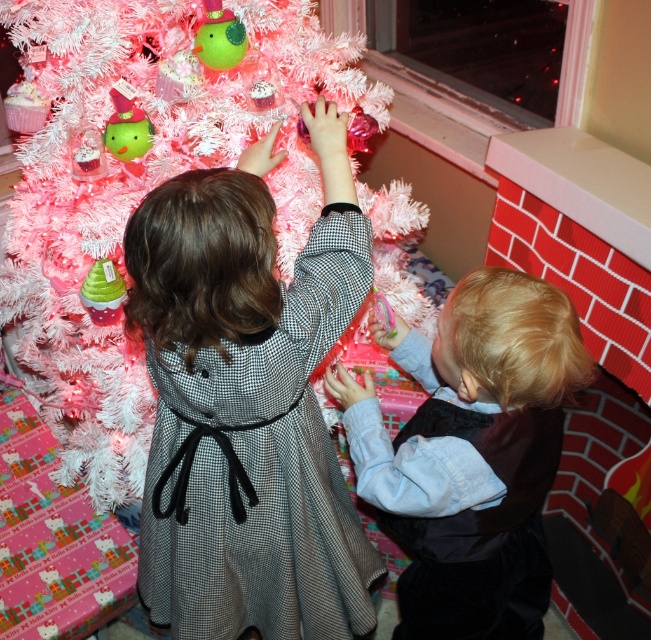
Question: Considering the real-world distances, which object is farthest from the blonde hair at lower right?

Choices:
 (A) white tinsel christmas tree at upper left
 (B) matte gray dress at center

Answer: (A)

Question: Is white tinsel christmas tree at upper left below blonde hair at lower right?

Choices:
 (A) yes
 (B) no

Answer: (B)

Question: Does matte gray dress at center have a smaller size compared to blonde hair at lower right?

Choices:
 (A) yes
 (B) no

Answer: (B)

Question: Which point is closer to the camera?

Choices:
 (A) (426, 554)
 (B) (296, 177)
 (C) (152, 260)

Answer: (C)

Question: Which object is the closest to the white tinsel christmas tree at upper left?

Choices:
 (A) matte gray dress at center
 (B) blonde hair at lower right

Answer: (A)

Question: Can you confirm if white tinsel christmas tree at upper left is positioned to the right of blonde hair at lower right?

Choices:
 (A) no
 (B) yes

Answer: (A)